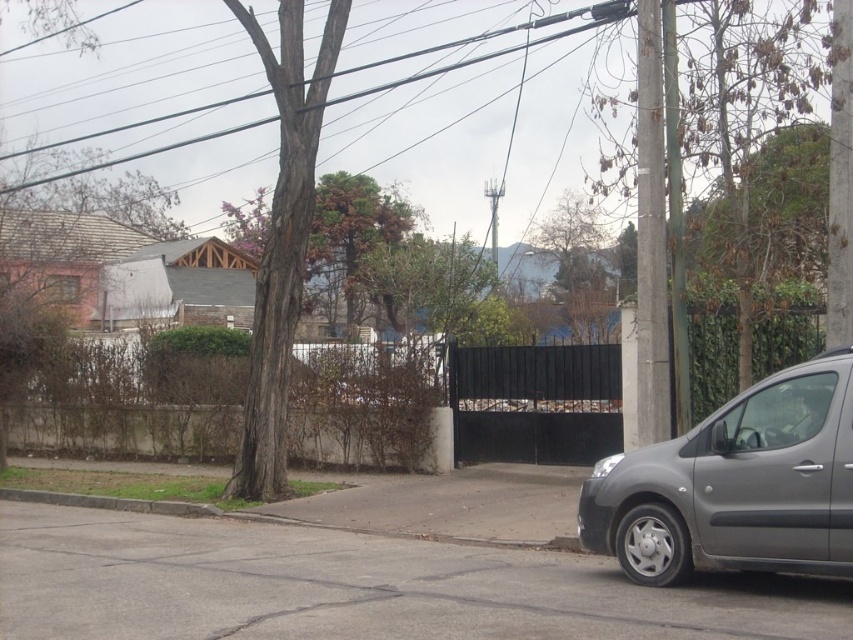
Question: Which point is farther to the camera?

Choices:
 (A) (682, 467)
 (B) (36, 180)
 (C) (299, 64)
 (D) (67, 504)

Answer: (B)

Question: Which of the following is the closest to the observer?

Choices:
 (A) (200, 140)
 (B) (79, 499)

Answer: (B)

Question: Is satin gray van at right smaller than black wire at upper center?

Choices:
 (A) no
 (B) yes

Answer: (B)

Question: Can you confirm if brown rough bark tree at center is bigger than green grass at lower left?

Choices:
 (A) no
 (B) yes

Answer: (B)

Question: Which point is farther from the camera taking this photo?

Choices:
 (A) (280, 163)
 (B) (633, 566)
 (C) (604, 4)
 (D) (51, 499)

Answer: (D)

Question: Is satin gray van at right behind brown rough bark tree at center?

Choices:
 (A) yes
 (B) no

Answer: (B)